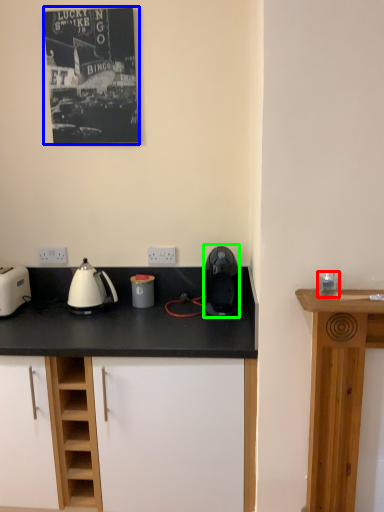
Question: Estimate the real-world distances between objects in this image. Which object is closer to appliance (highlighted by a red box), picture frame (highlighted by a blue box) or kitchen appliance (highlighted by a green box)?

Choices:
 (A) picture frame
 (B) kitchen appliance

Answer: (B)